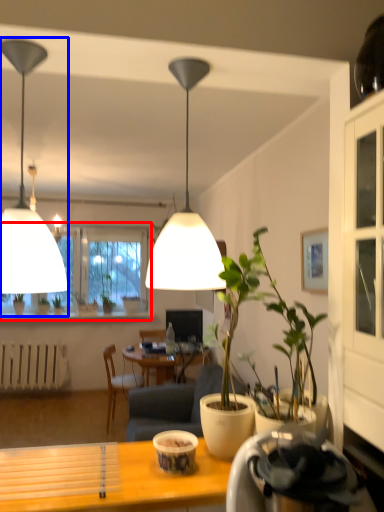
Question: Which point is closer to the camera, window (highlighted by a red box) or lamp (highlighted by a blue box)?

Choices:
 (A) window
 (B) lamp

Answer: (B)